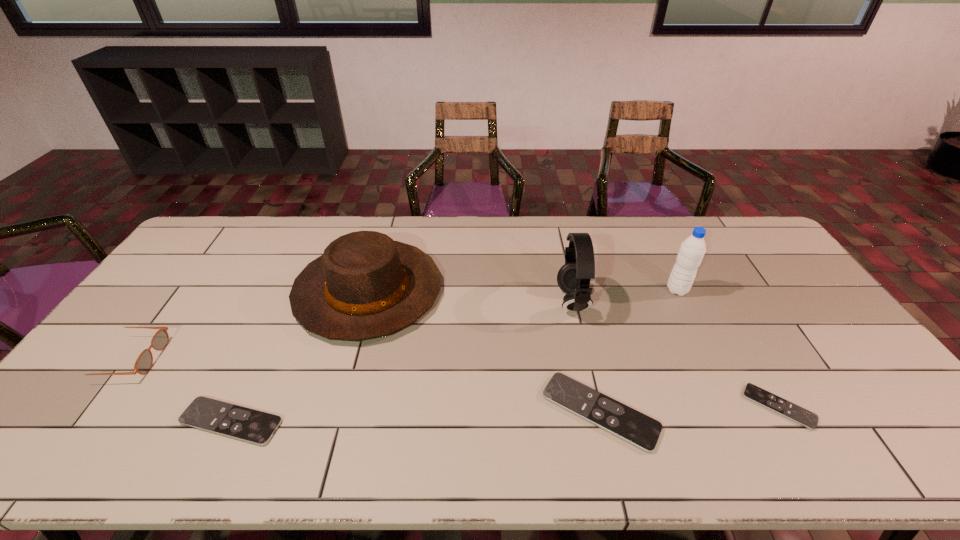
Find the location of a particular element. This screenshot has height=540, width=960. blank area located on the back of the second shortest remote control is located at coordinates (290, 296).

Find the location of a particular element. This screenshot has height=540, width=960. vacant space located 0.270m on the back of the second remote control from left to right is located at coordinates (575, 303).

Locate an element on the screen. The width and height of the screenshot is (960, 540). free region located on the back of the shortest remote control is located at coordinates (732, 325).

This screenshot has width=960, height=540. Identify the location of free location located on the ear cups of the earphone. (492, 301).

I want to click on vacant space located on the ear cups of the earphone, so click(512, 301).

You are a GUI agent. You are given a task and a screenshot of the screen. Output one action in this format:
    pyautogui.click(x=<x>, y=<y>)
    Task: Click on the free space located on the ear cups of the earphone
    The width and height of the screenshot is (960, 540).
    Given the screenshot: What is the action you would take?
    pyautogui.click(x=516, y=301)

At what (x,y) coordinates should I click in order to perform the action: click on free space located on the back of the water bottle. Please return your answer as a coordinate pair (x, y). The width and height of the screenshot is (960, 540). Looking at the image, I should click on (642, 219).

The height and width of the screenshot is (540, 960). In order to click on free point located on the left of the fifth shortest object in this screenshot , I will do `click(210, 291)`.

Identify the location of vacant area located on the front-facing side of the sunglasses. This screenshot has width=960, height=540. (236, 359).

The image size is (960, 540). I want to click on object located in the far edge section of the desktop, so click(x=365, y=285).